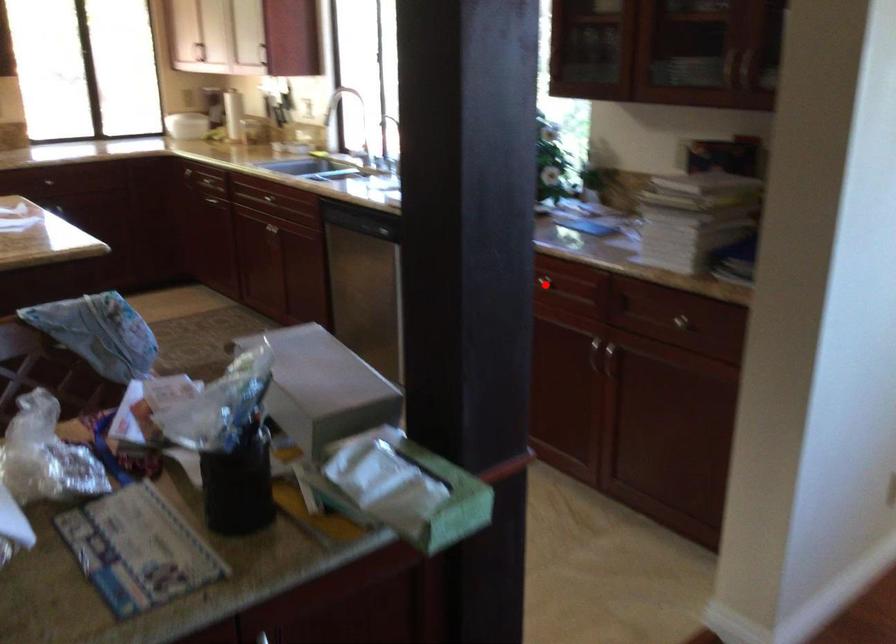
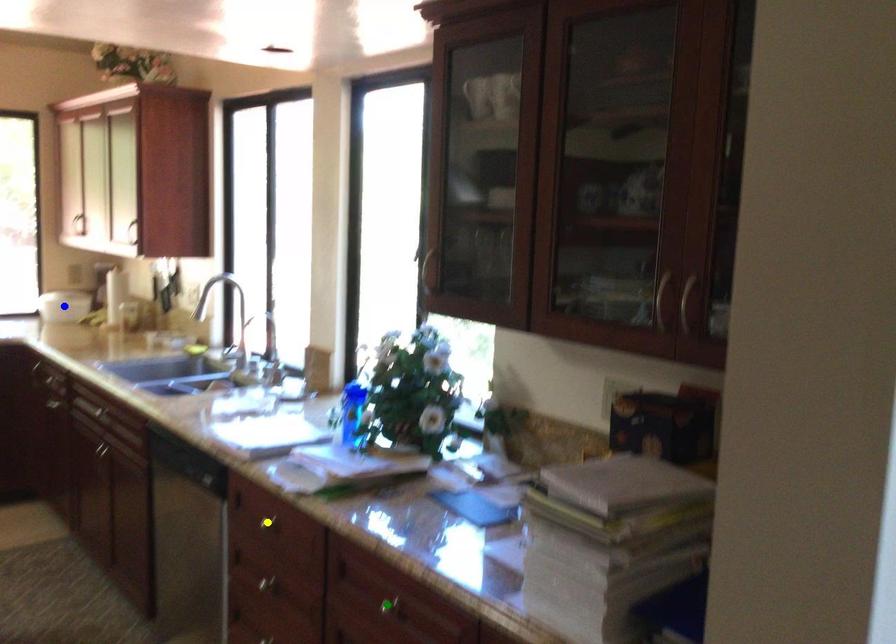
Question: I am providing you with two images of the same scene from different viewpoints. A red point is marked on the first image. You are given multiple points on the second image. Which mark in image 2 goes with the point in image 1?

Choices:
 (A) yellow point
 (B) green point
 (C) blue point

Answer: (B)